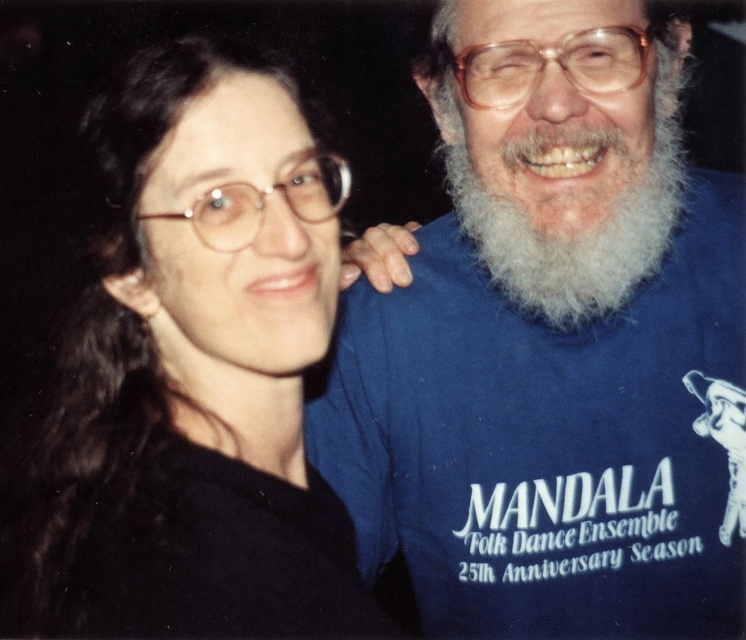
You are a photographer trying to adjust the lighting for a portrait. You notice a point at coordinates (195, 376). Which object is located at this point?

A: The point at coordinates (195, 376) is where the black matte shirt at left is located.

From the picture: You are a photographer who needs to adjust the lighting for a portrait. The subject is wearing a black matte shirt at left. Where should you place the light to best highlight the subject?

The black matte shirt at left is positioned at point (195, 376), so placing the light opposite to that position would best highlight the subject.